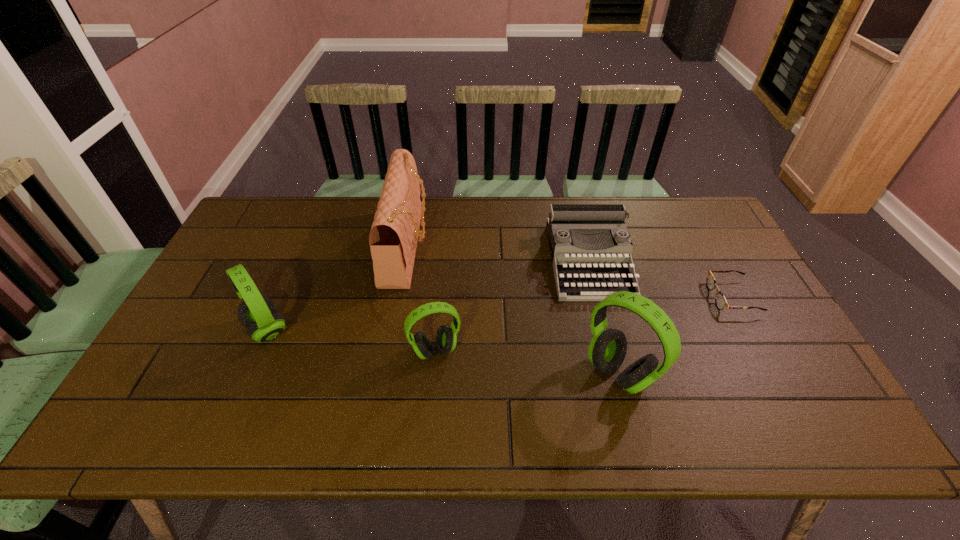
The height and width of the screenshot is (540, 960). In order to click on the leftmost object in this screenshot , I will do `click(258, 313)`.

Identify the location of the second tallest headset. The height and width of the screenshot is (540, 960). (258, 313).

Identify the location of the shortest headset. (446, 339).

In order to click on the second headset from right to left in this screenshot , I will do `click(446, 339)`.

Find the location of a particular element. Image resolution: width=960 pixels, height=540 pixels. the rightmost headset is located at coordinates (607, 350).

Locate an element on the screen. The image size is (960, 540). handbag is located at coordinates (393, 238).

This screenshot has width=960, height=540. Identify the location of typewriter. (571, 228).

Identify the location of the rightmost object. Image resolution: width=960 pixels, height=540 pixels. [720, 300].

Identify the location of spectacles. The width and height of the screenshot is (960, 540). (720, 300).

Image resolution: width=960 pixels, height=540 pixels. In order to click on free space located on the back of the third tallest object in this screenshot , I will do (x=299, y=258).